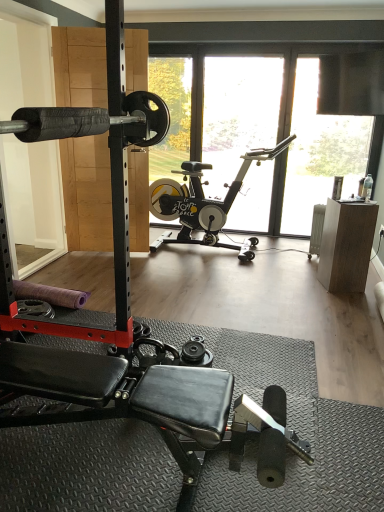
Question: Does black rubber barbell at left have a greater width compared to black rubber dumbbell at center?

Choices:
 (A) no
 (B) yes

Answer: (B)

Question: Considering the relative sizes of black rubber barbell at left and black rubber dumbbell at center in the image provided, is black rubber barbell at left taller than black rubber dumbbell at center?

Choices:
 (A) no
 (B) yes

Answer: (B)

Question: From the image's perspective, is black rubber barbell at left on top of black rubber dumbbell at center?

Choices:
 (A) yes
 (B) no

Answer: (A)

Question: From a real-world perspective, is black rubber barbell at left below black rubber dumbbell at center?

Choices:
 (A) yes
 (B) no

Answer: (B)

Question: Is black rubber barbell at left at the right side of black rubber dumbbell at center?

Choices:
 (A) no
 (B) yes

Answer: (A)

Question: Is black rubber barbell at left thinner than black rubber dumbbell at center?

Choices:
 (A) no
 (B) yes

Answer: (A)

Question: Can you confirm if transparent glass window at upper center is wider than black rubber barbell at left?

Choices:
 (A) no
 (B) yes

Answer: (A)

Question: Considering the relative sizes of transparent glass window at upper center and black rubber barbell at left in the image provided, is transparent glass window at upper center smaller than black rubber barbell at left?

Choices:
 (A) no
 (B) yes

Answer: (B)

Question: From the image's perspective, would you say transparent glass window at upper center is shown under black rubber barbell at left?

Choices:
 (A) no
 (B) yes

Answer: (A)

Question: Is transparent glass window at upper center positioned behind black rubber barbell at left?

Choices:
 (A) yes
 (B) no

Answer: (A)

Question: Is transparent glass window at upper center facing towards black rubber barbell at left?

Choices:
 (A) yes
 (B) no

Answer: (B)

Question: From a real-world perspective, is transparent glass window at upper center on top of black rubber barbell at left?

Choices:
 (A) yes
 (B) no

Answer: (B)

Question: Is black rubber stationary bicycle at center facing towards black rubber dumbbell at center?

Choices:
 (A) yes
 (B) no

Answer: (A)